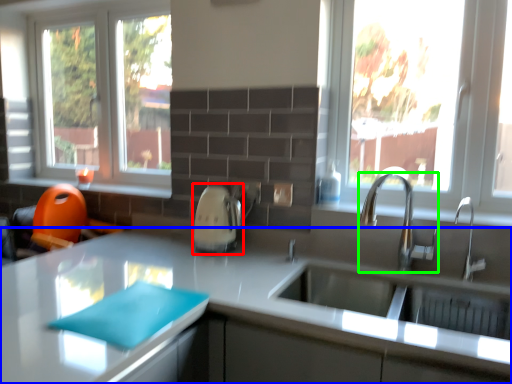
Question: Which object is the closest to the appliance (highlighted by a red box)? Choose among these: countertop (highlighted by a blue box) or tap (highlighted by a green box).

Choices:
 (A) countertop
 (B) tap

Answer: (A)